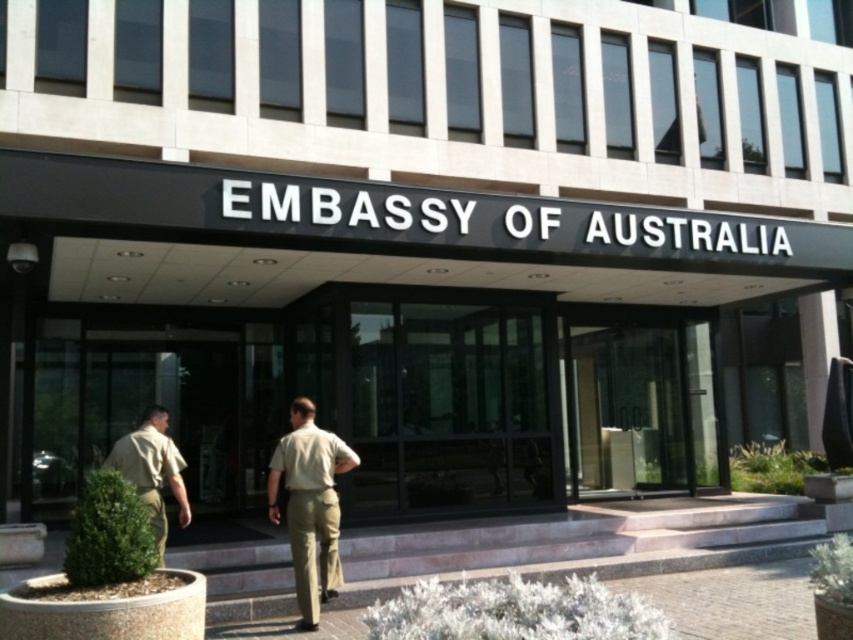
You are approaching the Embassy of Australia entrance. There is a point marked at coordinates [642,403]. What object is located at that point?

The transparent glass door at center is located at point [642,403].

You are approaching the Embassy of Australia entrance and see two points marked on the facade. The first point is at coordinate (323, 460) and the second is at (138, 477). Which point is closer to you as you face the entrance?

Point (323, 460) is closer to you because it is further to the viewer than point (138, 477).

You are standing at the entrance of the Embassy of Australia and want to know which of the two points, point (641, 337) or point (144, 424), is closer to you. Can you determine this based on their positions?

Point (641, 337) is further to the viewer than point (144, 424), so point (144, 424) is closer to you.